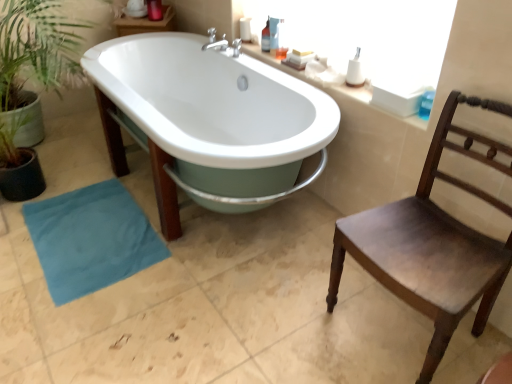
Question: From the image's perspective, is green leafy plant at left located beneath translucent plastic bottle at upper right, the second toiletry viewed from the front?

Choices:
 (A) yes
 (B) no

Answer: (A)

Question: Are green leafy plant at left and translucent plastic bottle at upper right, the 2th toiletry in the bottom-to-top sequence, far apart?

Choices:
 (A) yes
 (B) no

Answer: (A)

Question: Is green leafy plant at left smaller than translucent plastic bottle at upper right, the 2th toiletry in the right-to-left sequence?

Choices:
 (A) no
 (B) yes

Answer: (A)

Question: From a real-world perspective, is green leafy plant at left beneath translucent plastic bottle at upper right, the 2th toiletry in the bottom-to-top sequence?

Choices:
 (A) no
 (B) yes

Answer: (B)

Question: Does green leafy plant at left appear on the right side of translucent plastic bottle at upper right, the 2th toiletry in the right-to-left sequence?

Choices:
 (A) no
 (B) yes

Answer: (A)

Question: Is translucent plastic bottle at upper right, the 1th toiletry in the top-to-bottom sequence, at the back of green leafy plant at left?

Choices:
 (A) no
 (B) yes

Answer: (A)

Question: Is the position of translucent plastic bottle at upper right, the 1th toiletry in the top-to-bottom sequence, less distant than that of white glossy bathtub at center?

Choices:
 (A) yes
 (B) no

Answer: (B)

Question: Is translucent plastic bottle at upper right, the 1th toiletry in the top-to-bottom sequence, turned away from white glossy bathtub at center?

Choices:
 (A) yes
 (B) no

Answer: (B)

Question: Does translucent plastic bottle at upper right, the 2th toiletry in the bottom-to-top sequence, have a greater height compared to white glossy bathtub at center?

Choices:
 (A) yes
 (B) no

Answer: (B)

Question: Considering the relative sizes of translucent plastic bottle at upper right, the 2th toiletry in the right-to-left sequence, and white glossy bathtub at center in the image provided, is translucent plastic bottle at upper right, the 2th toiletry in the right-to-left sequence, shorter than white glossy bathtub at center?

Choices:
 (A) yes
 (B) no

Answer: (A)

Question: Is translucent plastic bottle at upper right, which is counted as the first toiletry, starting from the back, positioned beyond the bounds of white glossy bathtub at center?

Choices:
 (A) yes
 (B) no

Answer: (A)

Question: From the image's perspective, is translucent plastic bottle at upper right, marked as the 1th toiletry in a left-to-right arrangement, beneath white glossy bathtub at center?

Choices:
 (A) no
 (B) yes

Answer: (A)

Question: Is teal fabric towel at lower left oriented towards translucent plastic bottle at upper right, the 2th toiletry in the bottom-to-top sequence?

Choices:
 (A) no
 (B) yes

Answer: (A)